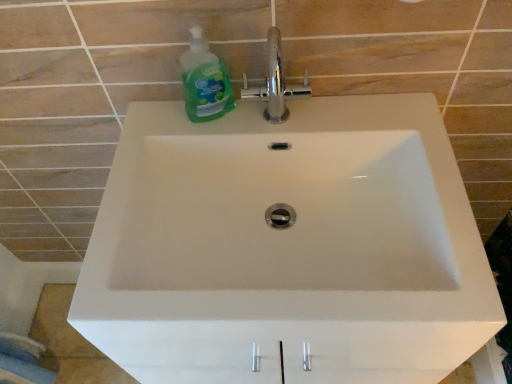
Image resolution: width=512 pixels, height=384 pixels. I want to click on vacant region to the left of green translucent liquid soap at upper left, so click(x=152, y=139).